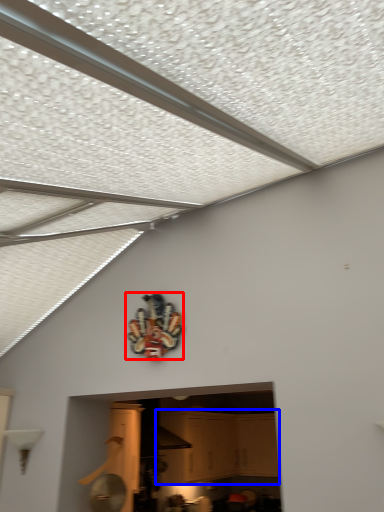
Question: Which object appears closest to the camera in this image, design (highlighted by a red box) or cabinetry (highlighted by a blue box)?

Choices:
 (A) design
 (B) cabinetry

Answer: (A)